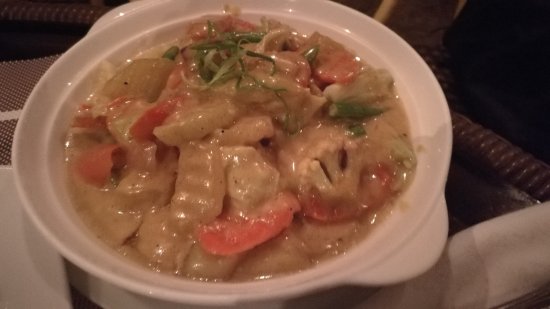
Identify the location of center of bowl. (236, 138).